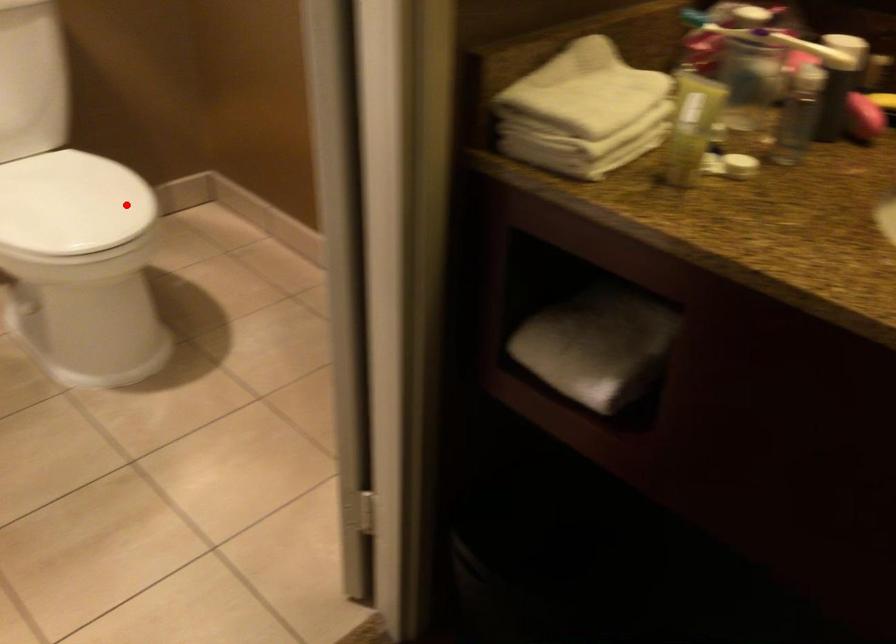
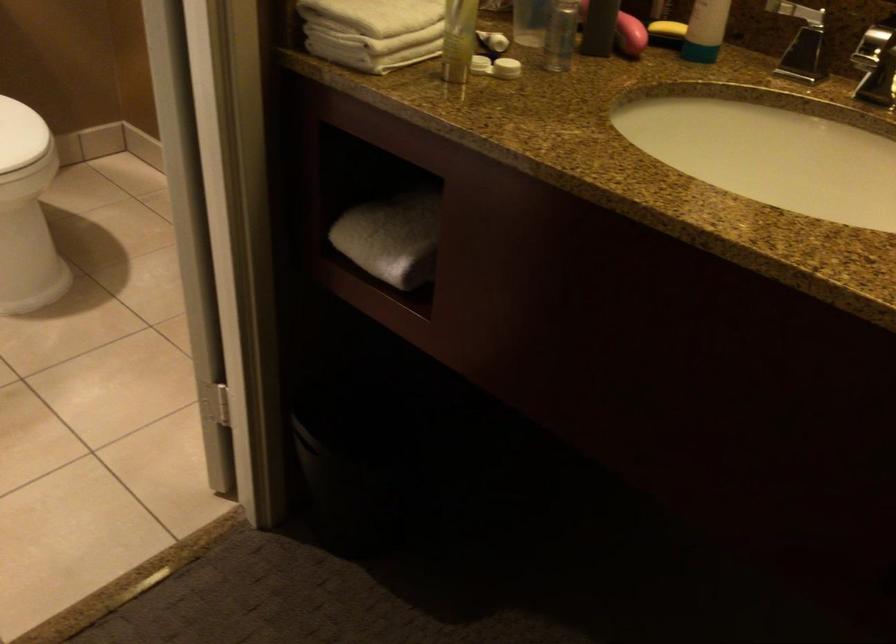
In the second image, find the point that corresponds to the highlighted location in the first image.

(20, 135)